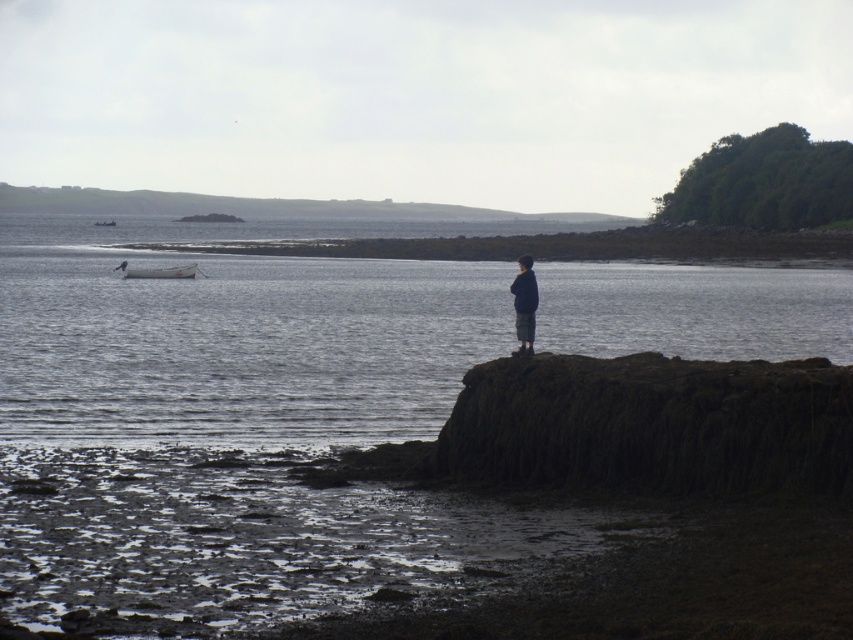
Question: Can you confirm if dark blue sweater at center is smaller than white plastic boat at left?

Choices:
 (A) no
 (B) yes

Answer: (B)

Question: Is dark blue sweater at center below white matte boat at left?

Choices:
 (A) yes
 (B) no

Answer: (A)

Question: Can you confirm if dark blue sweater at center is positioned below white plastic boat at left?

Choices:
 (A) no
 (B) yes

Answer: (B)

Question: Which of these objects is positioned farthest from the dark gray water at center?

Choices:
 (A) dark blue sweater at center
 (B) white plastic boat at left
 (C) white matte boat at left

Answer: (B)

Question: Which point is closer to the camera?

Choices:
 (A) (529, 264)
 (B) (115, 268)
 (C) (271, 321)

Answer: (A)

Question: Considering the real-world distances, which object is farthest from the white matte boat at left?

Choices:
 (A) white plastic boat at left
 (B) dark gray water at center

Answer: (A)